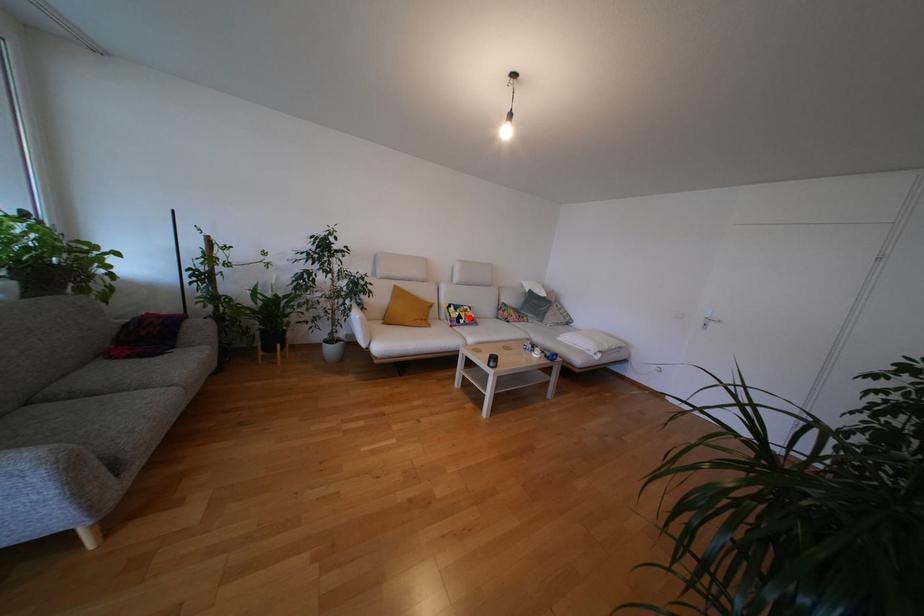
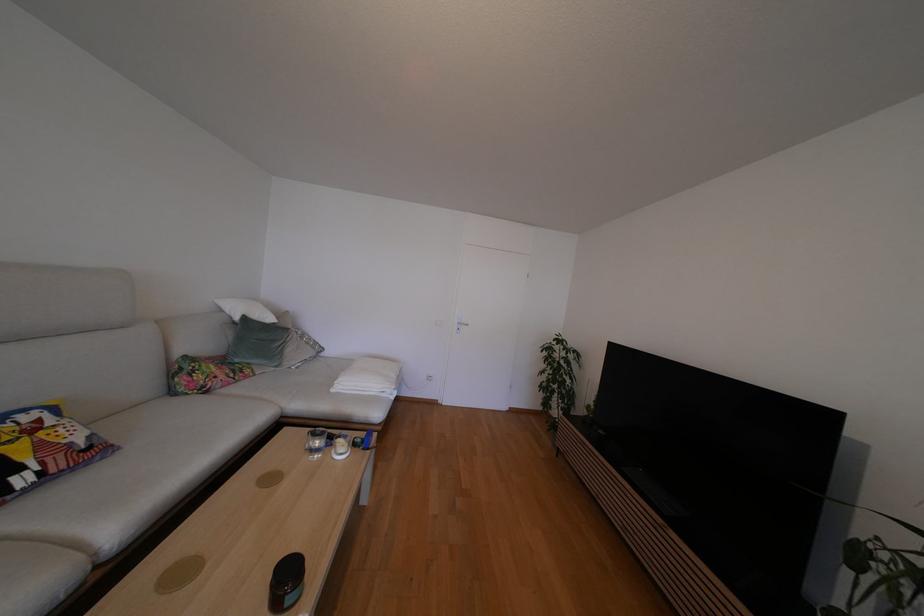
Where in the second image is the point corresponding to the highlighted location from the first image?

(44, 448)